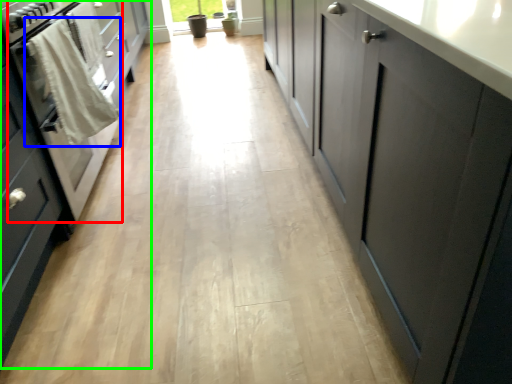
Question: Which object is positioned farthest from oven (highlighted by a red box)? Select from laundry (highlighted by a blue box) and cabinetry (highlighted by a green box).

Choices:
 (A) laundry
 (B) cabinetry

Answer: (B)